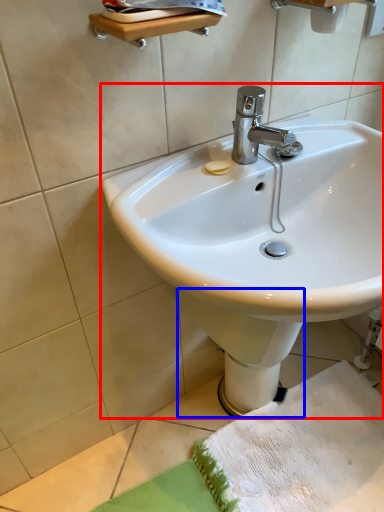
Question: Which of the following is the closest to the observer, sink (highlighted by a red box) or bidet (highlighted by a blue box)?

Choices:
 (A) sink
 (B) bidet

Answer: (A)